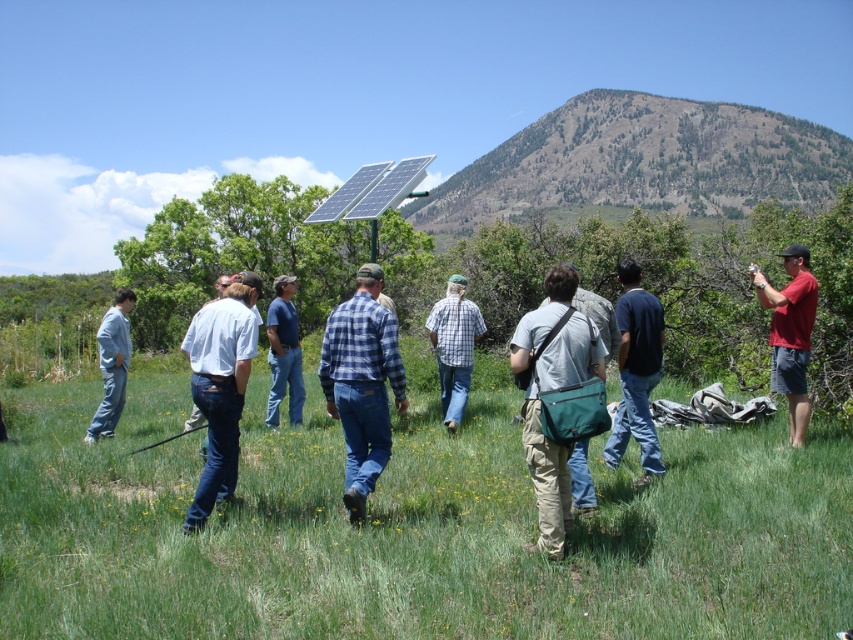
Who is more distant from viewer, (386, 432) or (799, 250)?

Positioned behind is point (799, 250).

You are a GUI agent. You are given a task and a screenshot of the screen. Output one action in this format:
    pyautogui.click(x=<x>, y=<y>)
    Task: Click on the plaid flannel shirt at center
    
    Given the screenshot: What is the action you would take?
    pyautogui.click(x=363, y=384)

In order to click on plaid flannel shirt at center in this screenshot , I will do `click(363, 384)`.

I want to click on plaid flannel shirt at center, so click(363, 384).

Is plaid flannel shirt at center below plaid shirt at center?

Indeed, plaid flannel shirt at center is positioned under plaid shirt at center.

Describe the element at coordinates (363, 384) in the screenshot. I see `plaid flannel shirt at center` at that location.

Between point (369, 369) and point (434, 314), which one is positioned behind?

Positioned behind is point (434, 314).

Where is `plaid flannel shirt at center`? This screenshot has width=853, height=640. plaid flannel shirt at center is located at coordinates (363, 384).

Can you confirm if plaid shirt at center is smaller than teal fabric bag at center?

Actually, plaid shirt at center might be larger than teal fabric bag at center.

Locate an element on the screen. The height and width of the screenshot is (640, 853). plaid shirt at center is located at coordinates (454, 346).